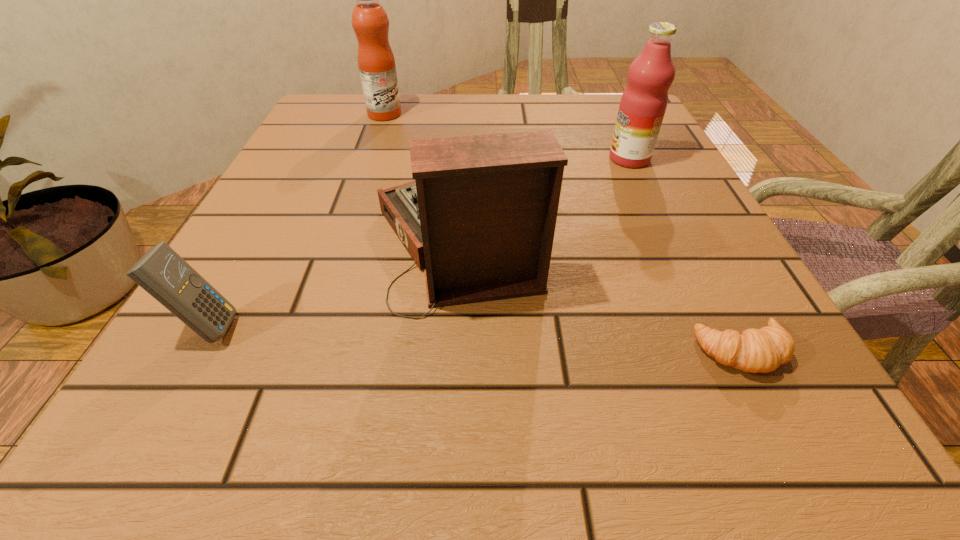
Locate an element on the screen. the second object from left to right is located at coordinates (376, 62).

The image size is (960, 540). I want to click on the left fruit juice, so click(x=376, y=62).

At what (x,y) coordinates should I click in order to perform the action: click on the second farthest object. Please return your answer as a coordinate pair (x, y). Looking at the image, I should click on (643, 104).

Find the location of a particular element. This screenshot has width=960, height=540. the nearer fruit juice is located at coordinates (643, 104).

Where is `phonograph record`? This screenshot has height=540, width=960. phonograph record is located at coordinates (480, 216).

You are a GUI agent. You are given a task and a screenshot of the screen. Output one action in this format:
    pyautogui.click(x=<x>, y=<y>)
    Task: Click on the second shortest object
    This screenshot has height=540, width=960.
    Given the screenshot: What is the action you would take?
    pyautogui.click(x=166, y=276)

Find the location of a particular element. The image size is (960, 540). calculator is located at coordinates 166,276.

Image resolution: width=960 pixels, height=540 pixels. In order to click on the shortest object in this screenshot , I will do `click(762, 350)`.

Find the location of a particular element. The height and width of the screenshot is (540, 960). vacant space located 0.070m on the front label of the fourth object from right to left is located at coordinates (431, 114).

Find the location of a particular element. free space located 0.060m on the label of the right fruit juice is located at coordinates (579, 159).